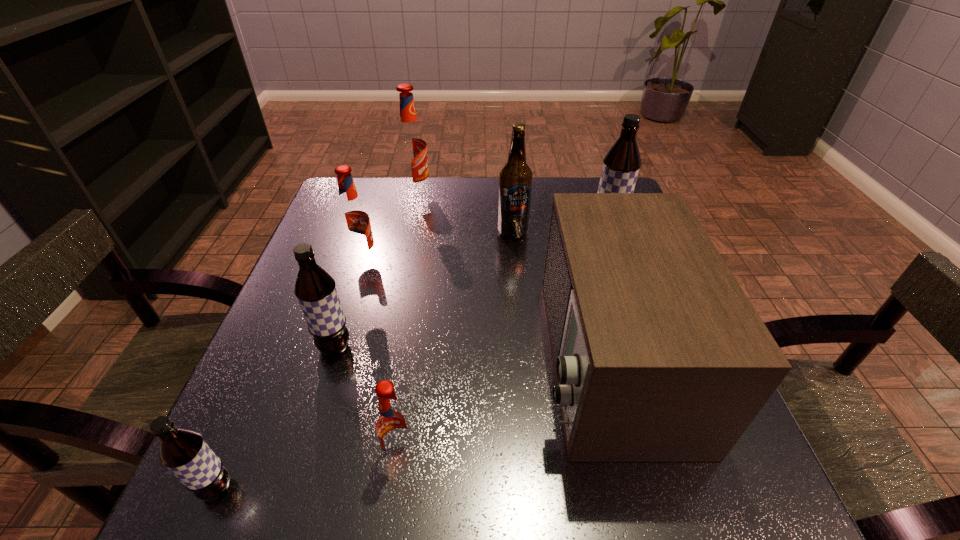
The width and height of the screenshot is (960, 540). Find the location of `vacant space located 0.240m on the front-facing side of the radio receiver`. vacant space located 0.240m on the front-facing side of the radio receiver is located at coordinates (409, 359).

The width and height of the screenshot is (960, 540). Find the location of `vacant space located 0.220m on the front-facing side of the radio receiver`. vacant space located 0.220m on the front-facing side of the radio receiver is located at coordinates (420, 359).

The height and width of the screenshot is (540, 960). What are the coordinates of `free space located 0.170m on the left of the fifth farthest root beer` in the screenshot? It's located at (275, 455).

Image resolution: width=960 pixels, height=540 pixels. In order to click on free spot located 0.310m on the right of the leftmost object in this screenshot , I will do `click(445, 488)`.

The image size is (960, 540). I want to click on beer bottle that is at the far edge, so click(x=515, y=180).

Where is `root beer present at the right edge`? This screenshot has width=960, height=540. root beer present at the right edge is located at coordinates (621, 165).

Where is `radio receiver located at the right edge`? Image resolution: width=960 pixels, height=540 pixels. radio receiver located at the right edge is located at coordinates [x=659, y=356].

Image resolution: width=960 pixels, height=540 pixels. What are the coordinates of `object located in the near left corner section of the desktop` in the screenshot? It's located at (184, 452).

The width and height of the screenshot is (960, 540). I want to click on object that is at the far right corner, so click(621, 165).

The height and width of the screenshot is (540, 960). In the image, there is a desktop. Find the location of `blank space at the far edge`. blank space at the far edge is located at coordinates (557, 185).